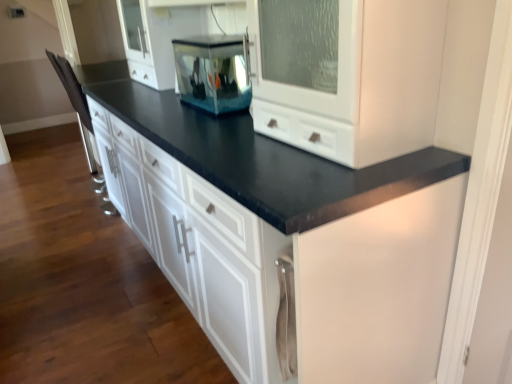
Question: Is transparent glass fish tank at center taller or shorter than matte black countertop at center?

Choices:
 (A) tall
 (B) short

Answer: (B)

Question: From the image's perspective, is transparent glass fish tank at center located above or below matte black countertop at center?

Choices:
 (A) above
 (B) below

Answer: (A)

Question: From a real-world perspective, is transparent glass fish tank at center physically located above or below matte black countertop at center?

Choices:
 (A) above
 (B) below

Answer: (A)

Question: From the image's perspective, is matte black countertop at center above or below transparent glass fish tank at center?

Choices:
 (A) below
 (B) above

Answer: (A)

Question: Is matte black countertop at center taller or shorter than transparent glass fish tank at center?

Choices:
 (A) tall
 (B) short

Answer: (A)

Question: Is matte black countertop at center in front of or behind transparent glass fish tank at center in the image?

Choices:
 (A) front
 (B) behind

Answer: (A)

Question: Considering the positions of point (318, 246) and point (186, 76), is point (318, 246) closer or farther from the camera than point (186, 76)?

Choices:
 (A) farther
 (B) closer

Answer: (B)